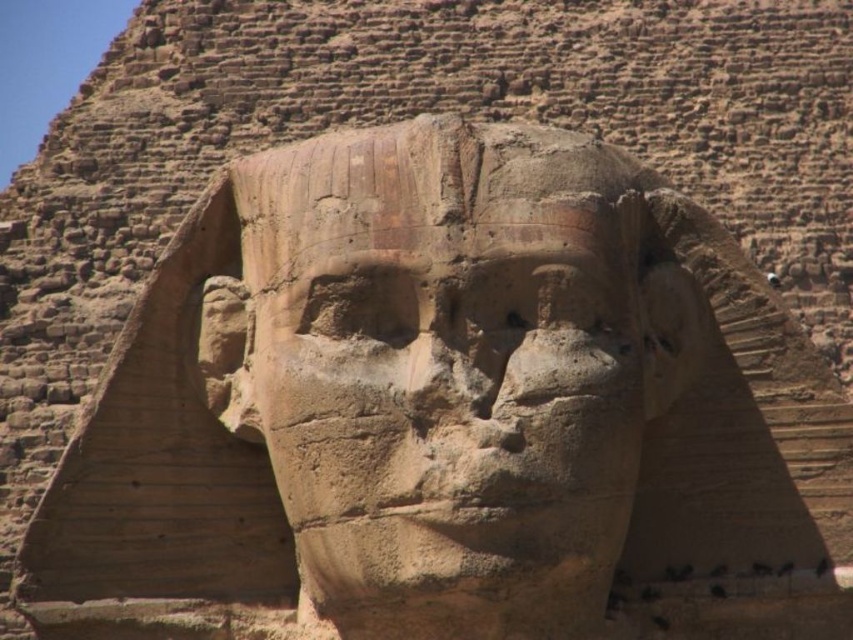
You are an archaeologist examining the Great Sphinx of Giza. You notice the sandstone statue at center and the brown stone nose at center. Which object is closer to you?

The sandstone statue at center is closer to you because it is in front of the brown stone nose at center.

You are an archaeologist examining the Great Sphinx of Giza. You notice the sandstone statue at center and the brown stone nose at center. Which object is wider?

The sandstone statue at center is wider than the brown stone nose at center.